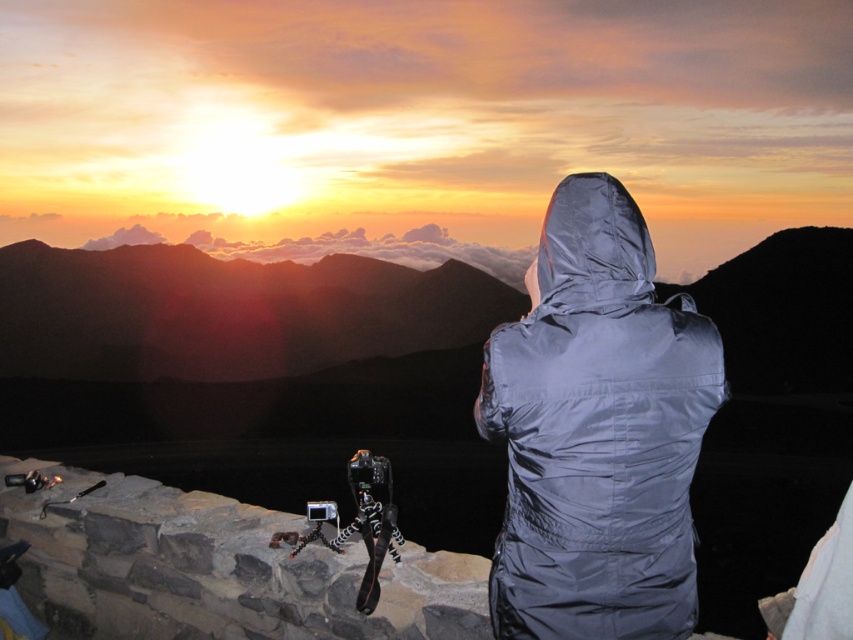
You are a photographer trying to adjust your camera settings while looking at the gray synthetic jacket at center and the glossy silver hood at center. Which object is nearer to your camera lens?

The gray synthetic jacket at center is closer to the viewer than the glossy silver hood at center, so the gray synthetic jacket at center is nearer to your camera lens.

You are a photographer trying to adjust your camera settings while standing on a stone wall during the sunset. You notice your gray synthetic jacket at center and your glossy silver hood at center. Which part of your clothing is closer to your camera lens?

The gray synthetic jacket at center is 6.81 inches away from the glossy silver hood at center. Since the question asks which is closer to the camera lens, but the description only provides the distance between the two objects, we cannot determine their individual distances to the lens. However, if the camera is positioned between them, the one closer to the lens would depend on their arrangement. Without additional information, we can only state the distance between them.

In the scene shown: You are a photographer who wants to adjust the camera settings while standing on the stone wall. The gray synthetic jacket at center and glossy silver hood at center are in your way. Which object should you move to have more vertical clearance?

The gray synthetic jacket at center has a greater height compared to the glossy silver hood at center, so you should move the gray synthetic jacket at center to gain more vertical clearance.